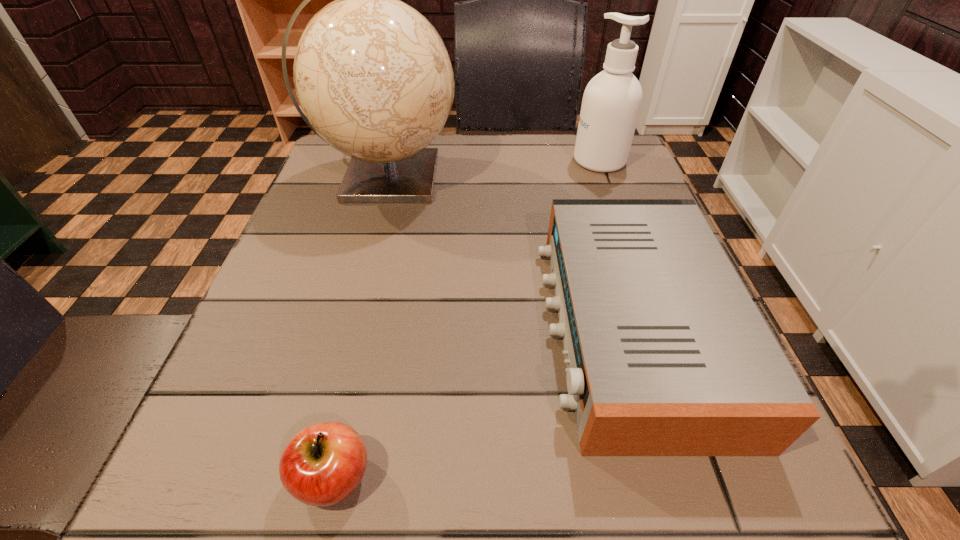
Identify the location of object located at the far left corner. (373, 76).

The width and height of the screenshot is (960, 540). Find the location of `object that is at the near left corner`. object that is at the near left corner is located at coordinates (323, 464).

You are a GUI agent. You are given a task and a screenshot of the screen. Output one action in this format:
    pyautogui.click(x=<x>, y=<y>)
    Task: Click on the object that is at the far right corner
    
    Given the screenshot: What is the action you would take?
    pyautogui.click(x=612, y=100)

Identify the location of object that is at the near right corner. This screenshot has height=540, width=960. (667, 355).

This screenshot has height=540, width=960. I want to click on free space at the far edge of the desktop, so click(x=457, y=155).

In the image, there is a desktop. Where is `vacant space at the left edge`? vacant space at the left edge is located at coordinates (333, 202).

This screenshot has height=540, width=960. In the image, there is a desktop. Identify the location of vacant space at the far left corner. (319, 173).

In order to click on free space at the far right corner of the desktop in this screenshot , I will do `click(636, 182)`.

This screenshot has width=960, height=540. What are the coordinates of `free space at the near right corner of the desktop` in the screenshot? It's located at (682, 487).

Where is `vacant area that lies between the cleansing agent and the globe`? vacant area that lies between the cleansing agent and the globe is located at coordinates (492, 169).